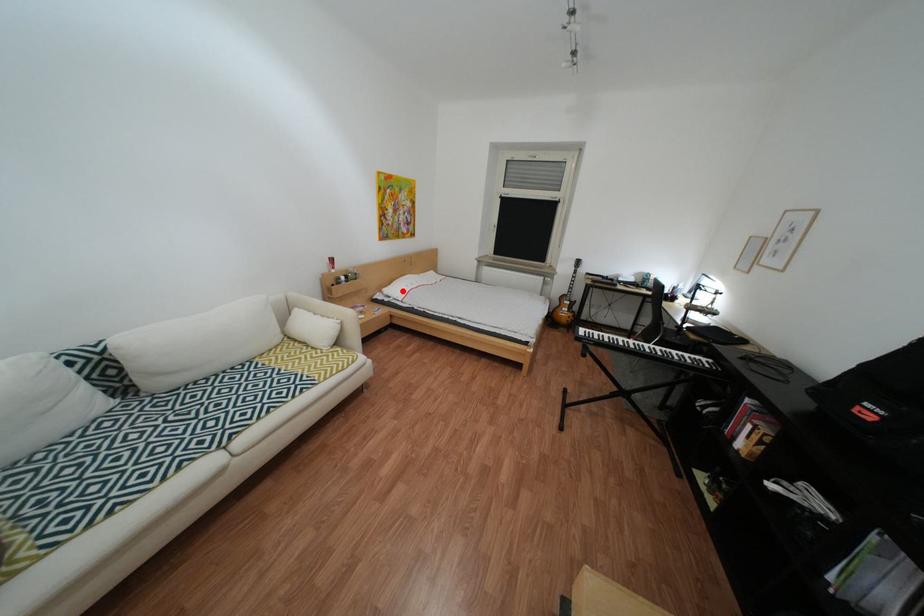
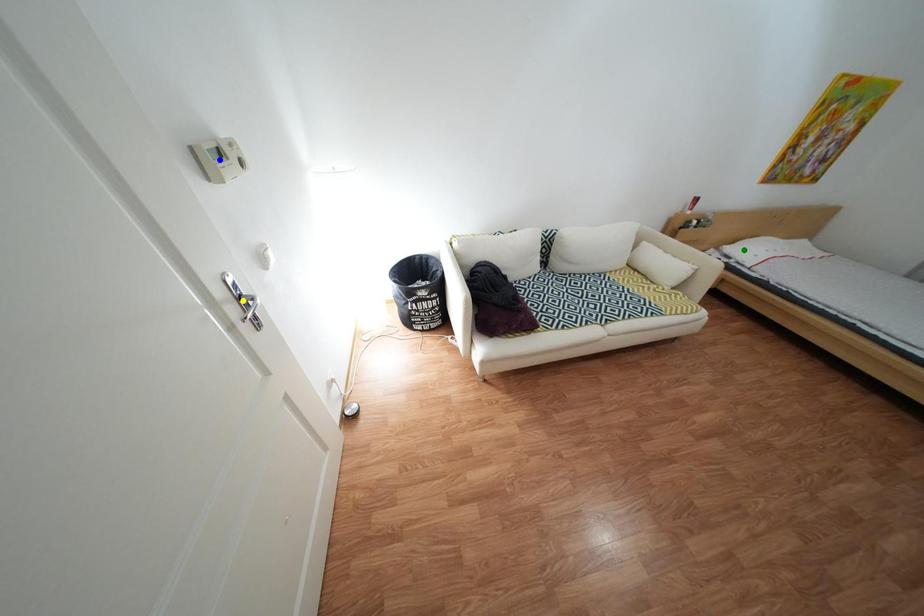
Question: I am providing you with two images of the same scene from different viewpoints. A red point is marked on the first image. You are given multiple points on the second image. Can you choose the point in image 2 that corresponds to the point in image 1?

Choices:
 (A) green point
 (B) blue point
 (C) yellow point

Answer: (A)